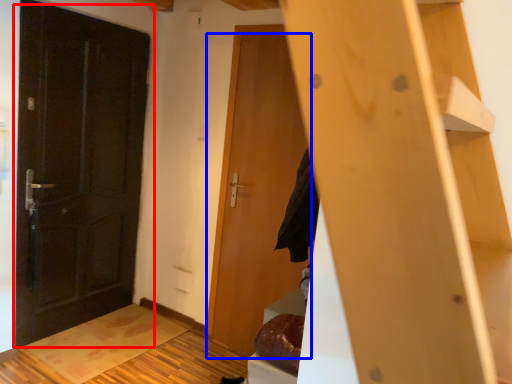
Question: Which object is further to the camera taking this photo, door (highlighted by a red box) or door (highlighted by a blue box)?

Choices:
 (A) door
 (B) door

Answer: (B)